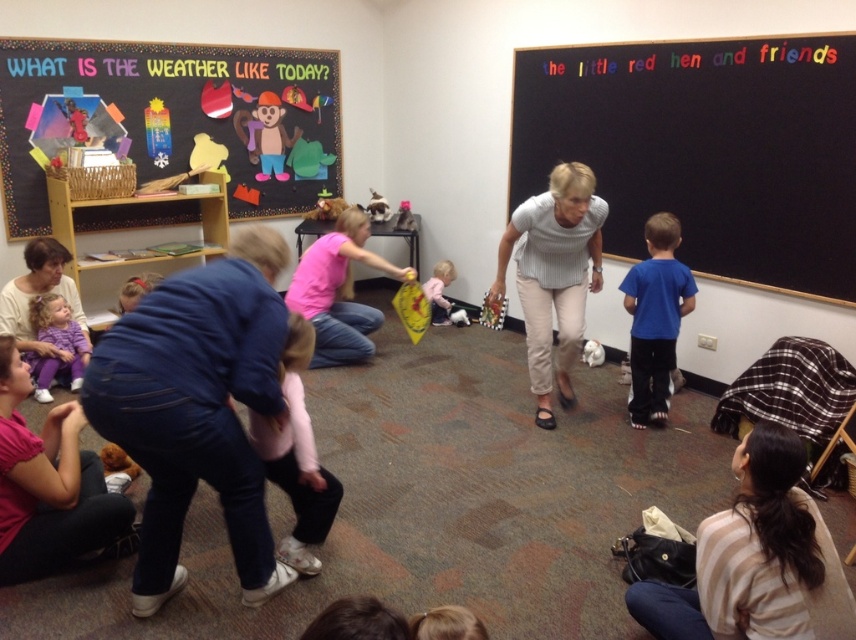
Question: From the image, what is the correct spatial relationship of multicolored paper cutouts at upper left in relation to gray striped shirt at center?

Choices:
 (A) below
 (B) above

Answer: (B)

Question: Is pink fabric shirt at lower left further to camera compared to light pink fabric dress at center?

Choices:
 (A) no
 (B) yes

Answer: (A)

Question: Which point is closer to the camera?

Choices:
 (A) (649, 230)
 (B) (675, 596)
 (C) (670, 45)

Answer: (B)

Question: Is multicolored paper cutouts at upper left below blue matte shirt at center?

Choices:
 (A) no
 (B) yes

Answer: (A)

Question: Which of the following is the farthest from the observer?

Choices:
 (A) (0, 483)
 (B) (849, 214)

Answer: (B)

Question: Which of the following is the farthest from the observer?

Choices:
 (A) click(657, 80)
 (B) click(284, 561)

Answer: (A)